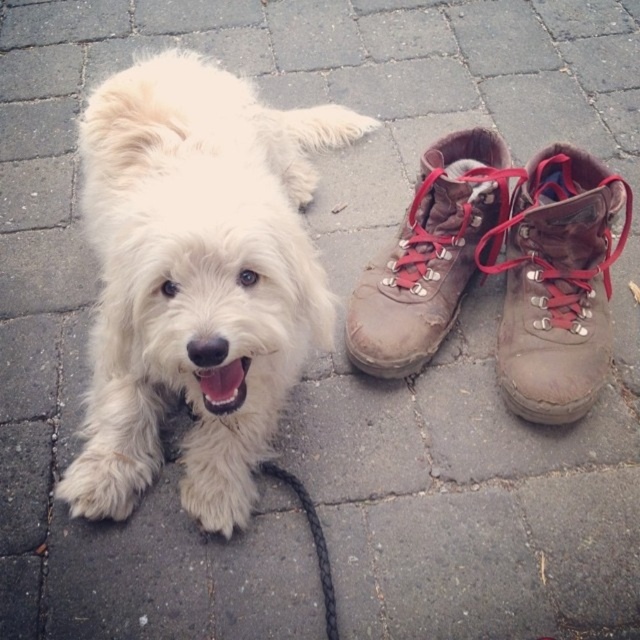
Question: Which object appears closest to the camera in this image?

Choices:
 (A) brown leather boot at center
 (B) white fluffy dog at upper left

Answer: (B)

Question: Does brown leather boot at right appear on the right side of black braided leash at lower center?

Choices:
 (A) no
 (B) yes

Answer: (B)

Question: Does white fluffy dog at upper left have a greater width compared to black braided leash at lower center?

Choices:
 (A) no
 (B) yes

Answer: (B)

Question: Which of the following is the farthest from the observer?

Choices:
 (A) (570, 349)
 (B) (500, 161)

Answer: (B)

Question: Which point appears closest to the camera in this image?

Choices:
 (A) pos(193,276)
 (B) pos(333,604)

Answer: (A)

Question: Does brown leather boot at center lie in front of black braided leash at lower center?

Choices:
 (A) no
 (B) yes

Answer: (A)